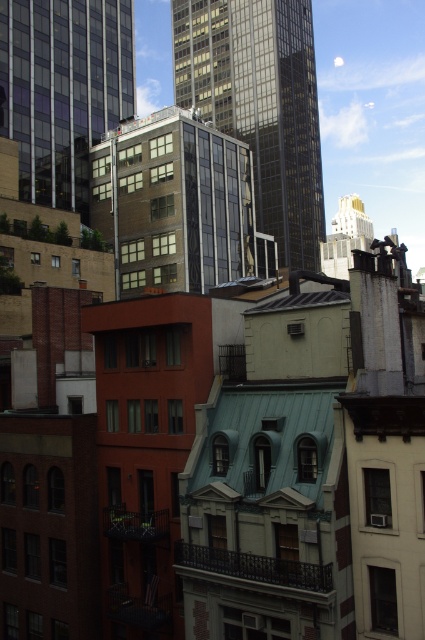
Question: Can you confirm if green glass building at center is positioned to the right of matte glass building at upper left?

Choices:
 (A) no
 (B) yes

Answer: (B)

Question: Among these objects, which one is farthest from the camera?

Choices:
 (A) matte glass building at upper left
 (B) glassy reflective skyscraper at center
 (C) green glass building at center

Answer: (B)

Question: Estimate the real-world distances between objects in this image. Which object is closer to the glassy reflective skyscraper at center?

Choices:
 (A) matte glass building at upper left
 (B) green glass building at center

Answer: (B)

Question: Is glassy reflective skyscraper at center in front of green glass building at center?

Choices:
 (A) yes
 (B) no

Answer: (B)

Question: Does green glass building at center appear under matte glass building at upper left?

Choices:
 (A) yes
 (B) no

Answer: (A)

Question: Which point appears farthest from the camera in this image?

Choices:
 (A) (147, 172)
 (B) (115, 13)

Answer: (B)